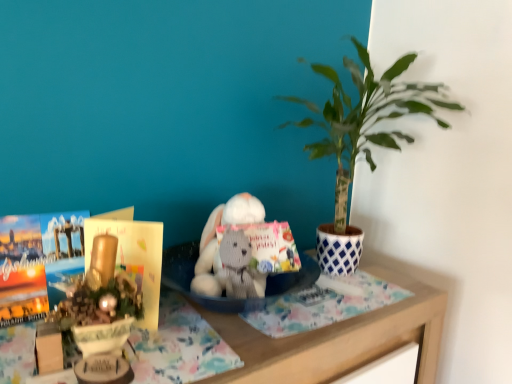
Locate an element on the screen. free location in front of gray knitted stuffed animal at center is located at coordinates (224, 342).